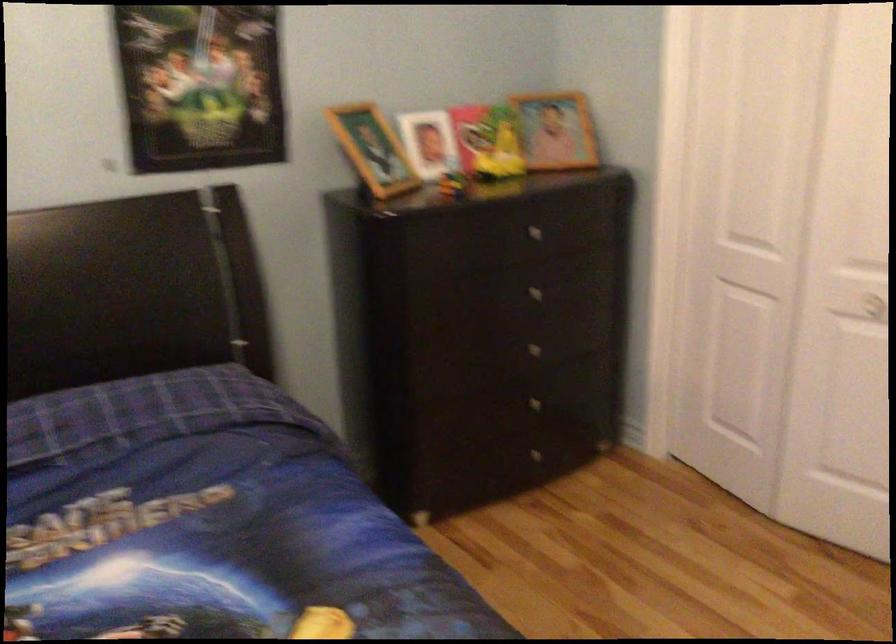
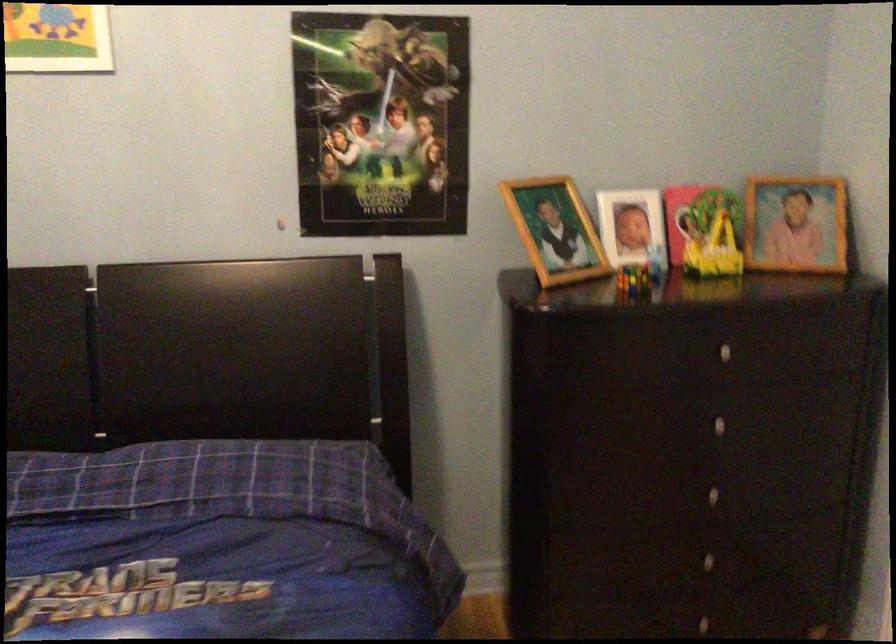
Find the pixel in the second image that matches point 550,129 in the first image.

(796, 223)